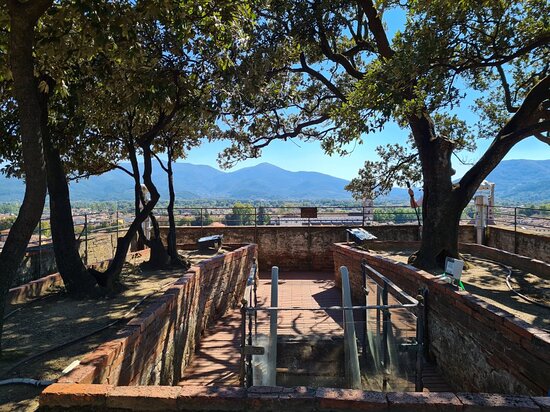
You are a GUI agent. You are given a task and a screenshot of the screen. Output one action in this format:
    pyautogui.click(x=<x>, y=<y>)
    Task: Click on the glass
    This screenshot has height=412, width=550.
    Given the screenshot: What is the action you would take?
    pyautogui.click(x=393, y=336), pyautogui.click(x=298, y=345)